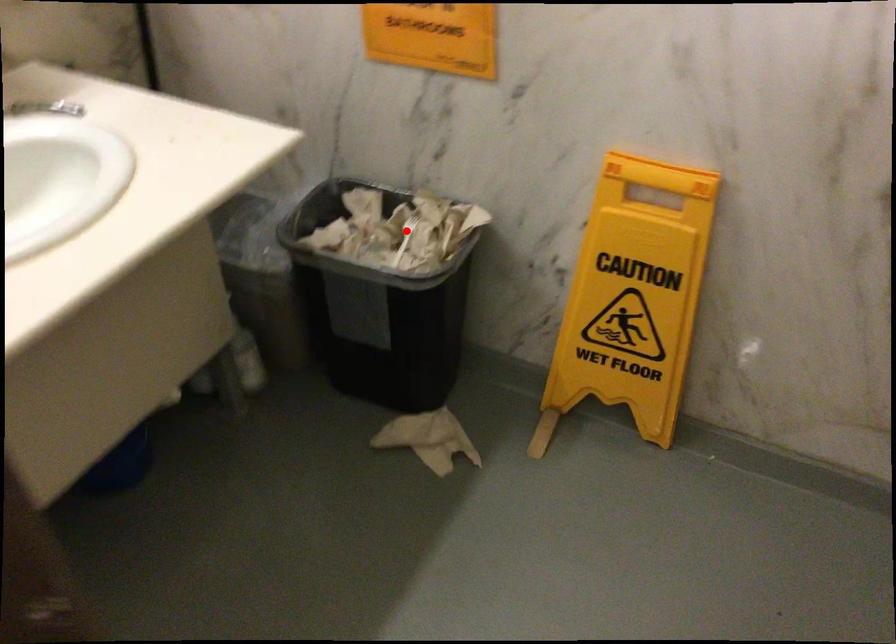
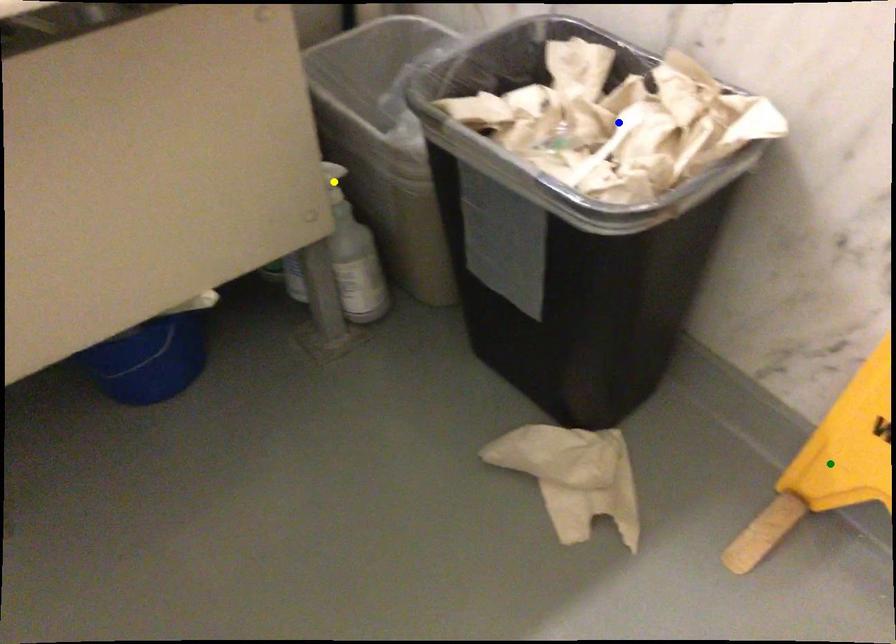
Question: I am providing you with two images of the same scene from different viewpoints. A red point is marked on the first image. You are given multiple points on the second image. Can you choose the point in image 2 that corresponds to the point in image 1?

Choices:
 (A) blue point
 (B) green point
 (C) yellow point

Answer: (A)